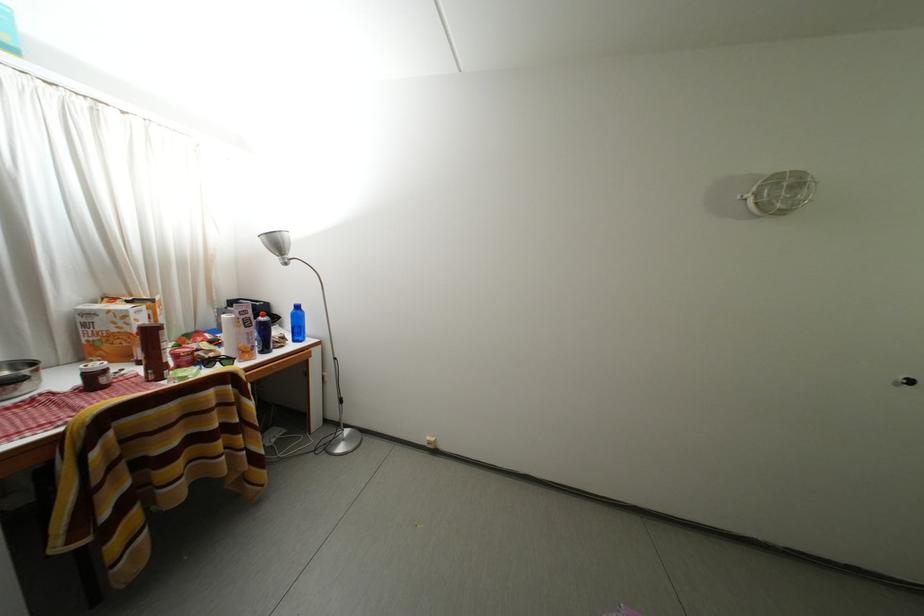
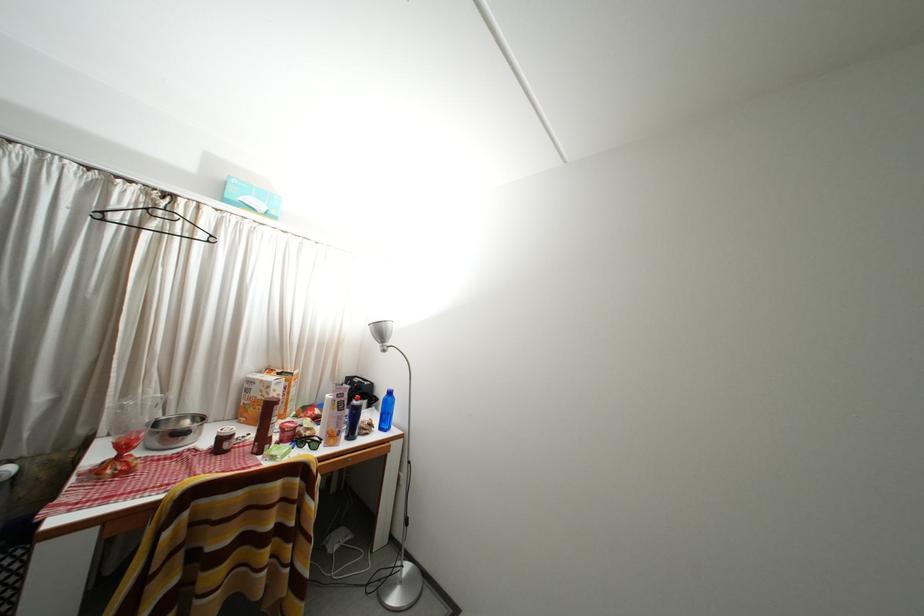
The first image is from the beginning of the video and the second image is from the end. How did the camera likely rotate when shooting the video?

The camera's rotation is toward left-up.